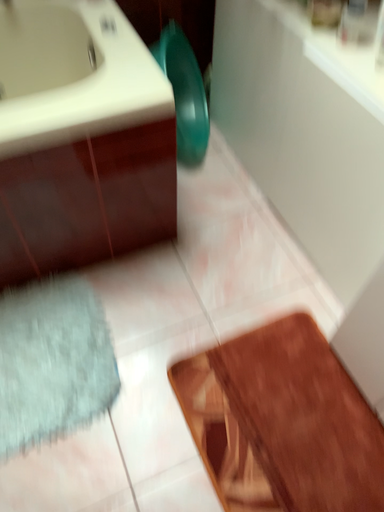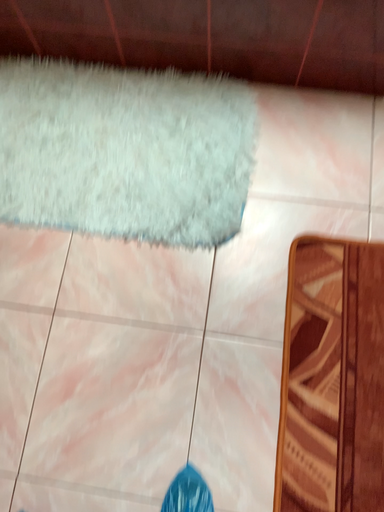
Question: How did the camera likely rotate when shooting the video?

Choices:
 (A) rotated left
 (B) rotated right

Answer: (A)